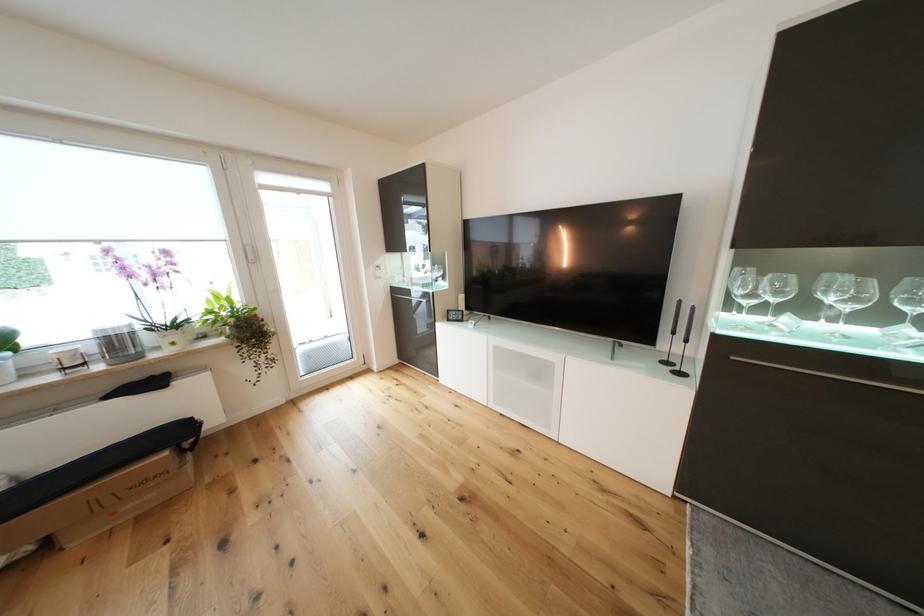
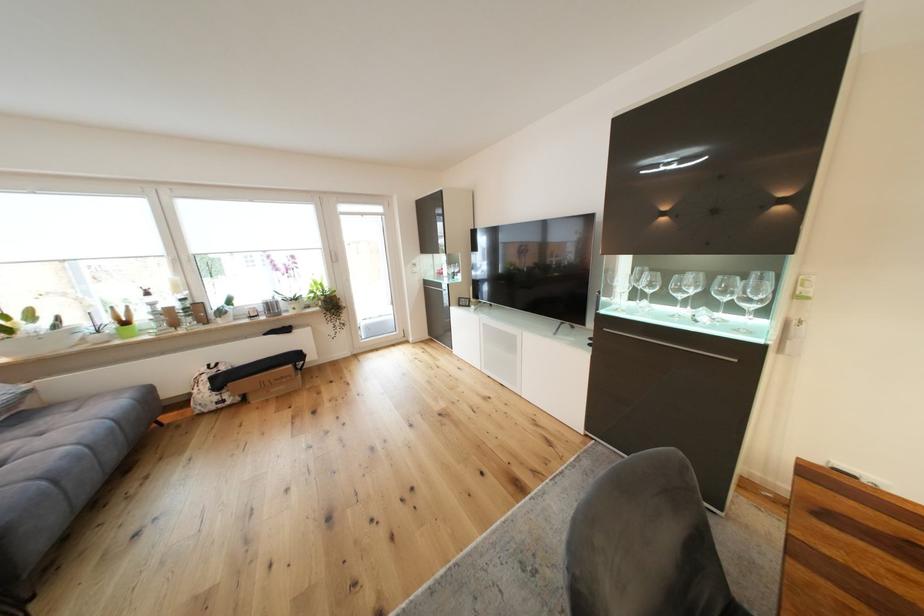
Consider the image. What movement of the cameraman would produce the second image?

The cameraman moved toward right, backward.